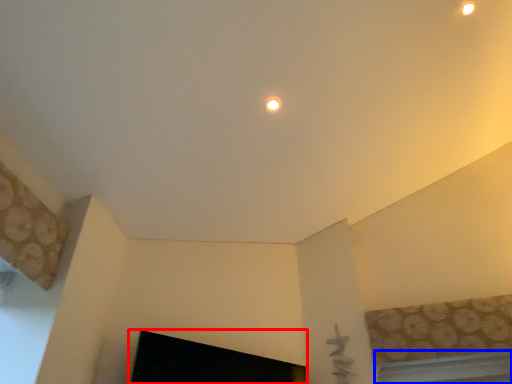
Question: Among these objects, which one is farthest to the camera, fireplace (highlighted by a red box) or window (highlighted by a blue box)?

Choices:
 (A) fireplace
 (B) window

Answer: (B)